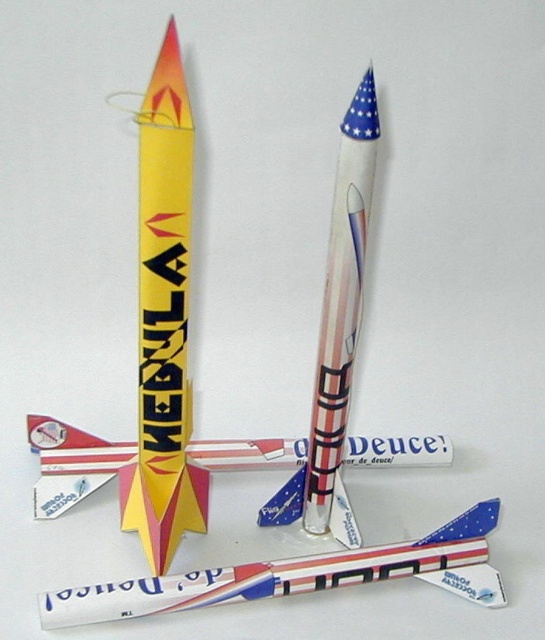
Question: Does white glossy rocket at lower center appear on the right side of american flag paper rocket at center?

Choices:
 (A) no
 (B) yes

Answer: (A)

Question: Considering the real-world distances, which object is closest to the white glossy rocket at lower center?

Choices:
 (A) american flag paper rocket at center
 (B) yellow matte rocket at center
 (C) metallic silver airplane at center

Answer: (C)

Question: Among these objects, which one is farthest from the camera?

Choices:
 (A) yellow matte rocket at center
 (B) white glossy rocket at lower center

Answer: (B)

Question: Which point is farther to the camera?

Choices:
 (A) (171, 364)
 (B) (414, 436)
 (C) (196, 593)

Answer: (B)

Question: Is white glossy rocket at lower center to the left of metallic silver airplane at center from the viewer's perspective?

Choices:
 (A) yes
 (B) no

Answer: (B)

Question: Does white glossy rocket at lower center have a larger size compared to american flag paper rocket at center?

Choices:
 (A) yes
 (B) no

Answer: (B)